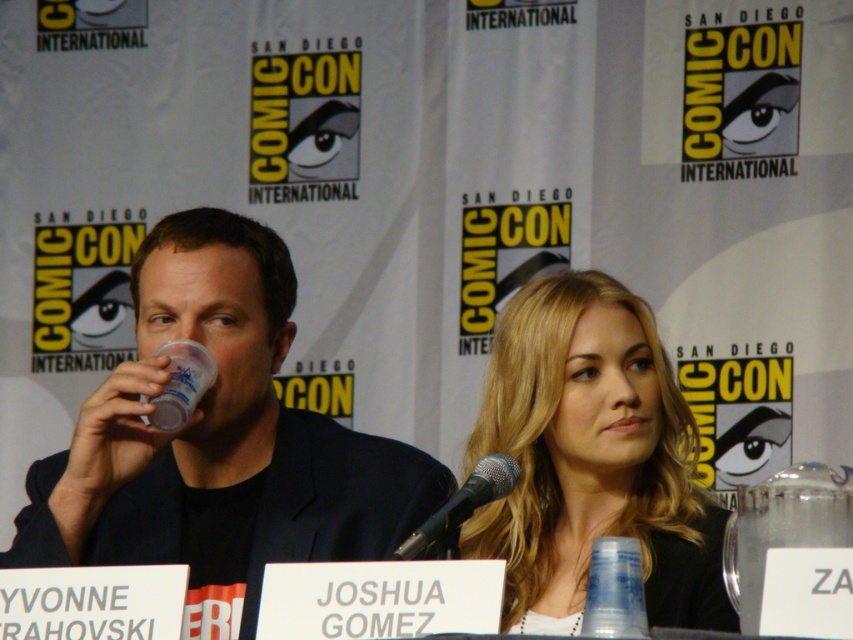
Is transparent plastic cup at center shorter than black metallic microphone at center?

Yes, transparent plastic cup at center is shorter than black metallic microphone at center.

Consider the image. Is transparent plastic cup at center to the left of black metallic microphone at center from the viewer's perspective?

Incorrect, transparent plastic cup at center is not on the left side of black metallic microphone at center.

Locate an element on the screen. transparent plastic cup at center is located at coordinates (614, 589).

This screenshot has width=853, height=640. I want to click on transparent plastic cup at center, so click(x=614, y=589).

Does transparent plastic cup at center appear under translucent plastic cup at upper left?

Indeed, transparent plastic cup at center is positioned under translucent plastic cup at upper left.

Between transparent plastic cup at center and translucent plastic cup at upper left, which one appears on the left side from the viewer's perspective?

From the viewer's perspective, translucent plastic cup at upper left appears more on the left side.

Between point (589, 566) and point (175, 364), which one is positioned in front?

Point (175, 364)

You are a GUI agent. You are given a task and a screenshot of the screen. Output one action in this format:
    pyautogui.click(x=<x>, y=<y>)
    Task: Click on the transparent plastic cup at center
    The height and width of the screenshot is (640, 853).
    Given the screenshot: What is the action you would take?
    pyautogui.click(x=614, y=589)

Is point (410, 540) in front of point (212, 369)?

Yes, point (410, 540) is in front of point (212, 369).

Can you confirm if black metallic microphone at center is positioned below translucent plastic cup at upper left?

Correct, black metallic microphone at center is located below translucent plastic cup at upper left.

Is point (508, 488) closer to viewer compared to point (184, 342)?

Yes, point (508, 488) is in front of point (184, 342).

The image size is (853, 640). In order to click on black metallic microphone at center in this screenshot , I will do `click(463, 502)`.